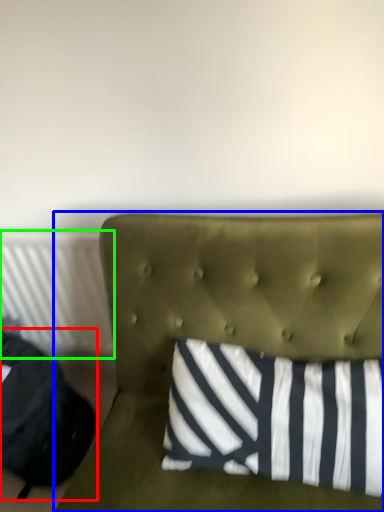
Question: Which object is the farthest from bean bag chair (highlighted by a red box)? Choose among these: furniture (highlighted by a blue box) or radiator (highlighted by a green box).

Choices:
 (A) furniture
 (B) radiator

Answer: (A)